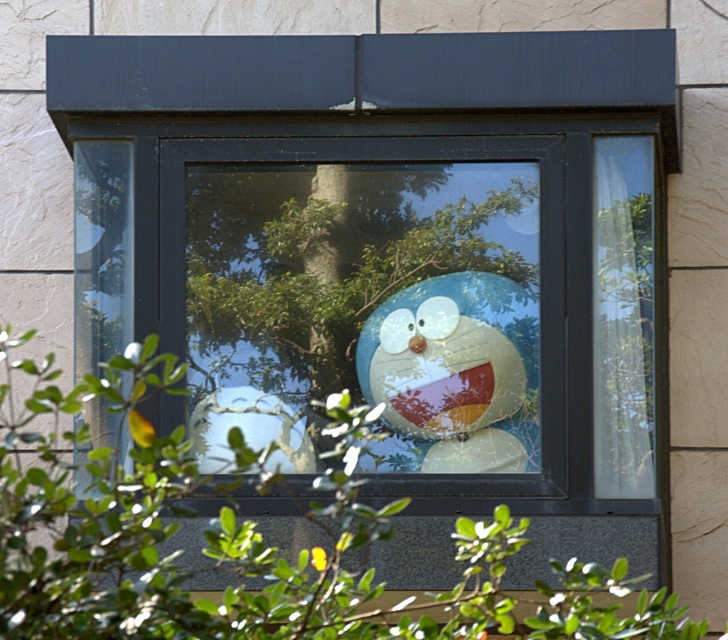
Question: Is green leafy tree at center wider than translucent plastic toy at center?

Choices:
 (A) no
 (B) yes

Answer: (B)

Question: Which point is closer to the camera?

Choices:
 (A) translucent plastic toy at center
 (B) green leafy tree at center

Answer: (B)

Question: Among these points, which one is farthest from the camera?

Choices:
 (A) (75, 548)
 (B) (389, 356)

Answer: (B)

Question: Is green leafy tree at center bigger than translucent plastic toy at center?

Choices:
 (A) no
 (B) yes

Answer: (B)

Question: Does green leafy tree at center appear on the right side of translucent plastic toy at center?

Choices:
 (A) no
 (B) yes

Answer: (A)